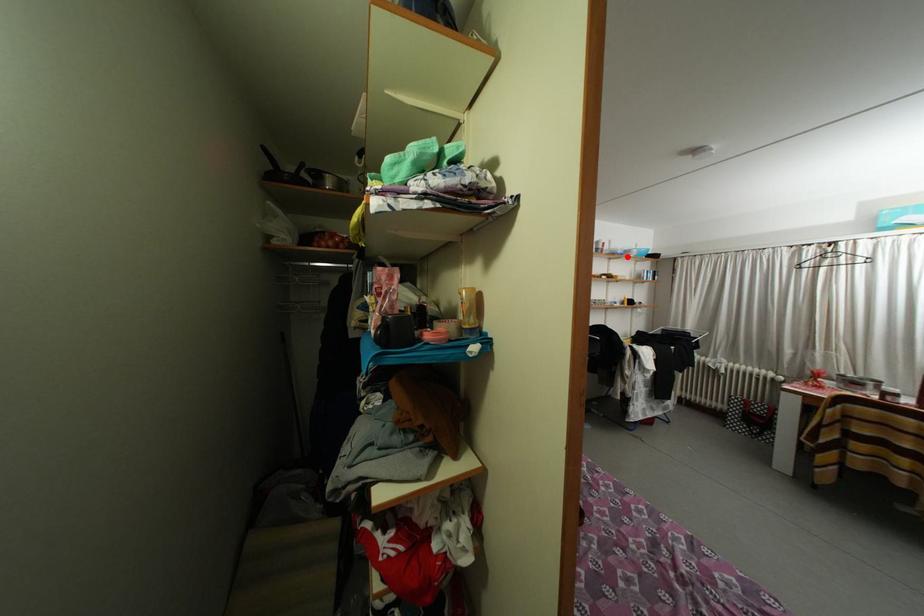
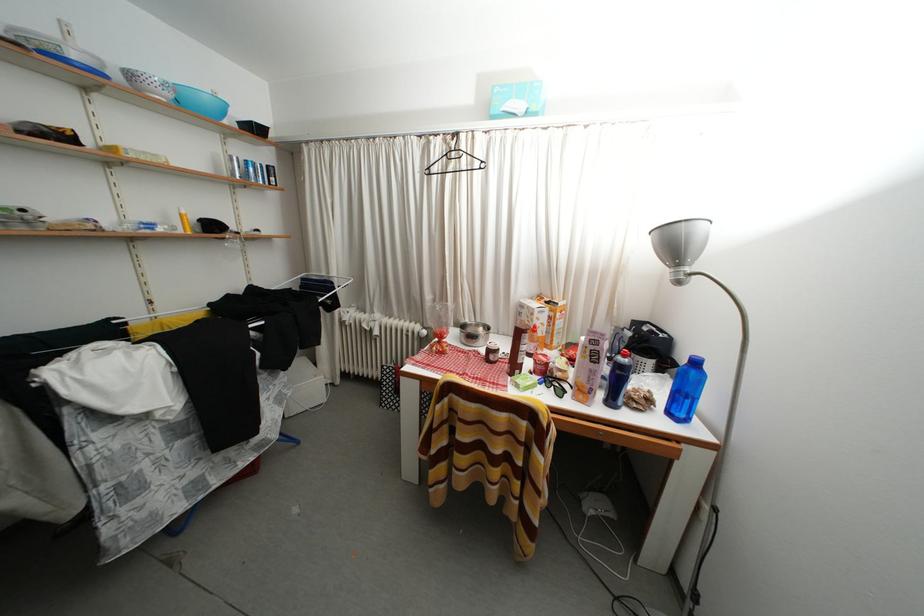
Locate, in the second image, the point that corresponds to the highlighted location in the first image.

(81, 61)